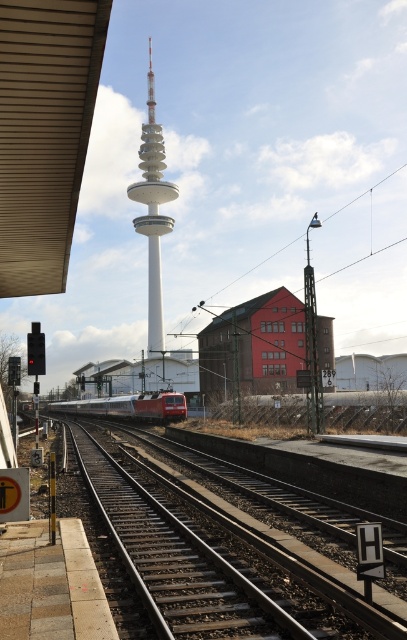
You are a passenger waiting at the train station and want to board the red glossy train at center. You notice a sign indicating the platform is on the left side. Which direction should you move relative to the white smooth tower at center to reach the platform?

You should move to the left side of the white smooth tower at center to reach the platform since the tower is on the right side of the red glossy train at center, meaning the platform is on the opposite side.

You are a passenger waiting at the train station. You notice the smooth metal train track at center and the red glossy train at center. Which object appears narrower in the image?

The smooth metal train track at center is thinner than the red glossy train at center, so the smooth metal train track at center appears narrower.